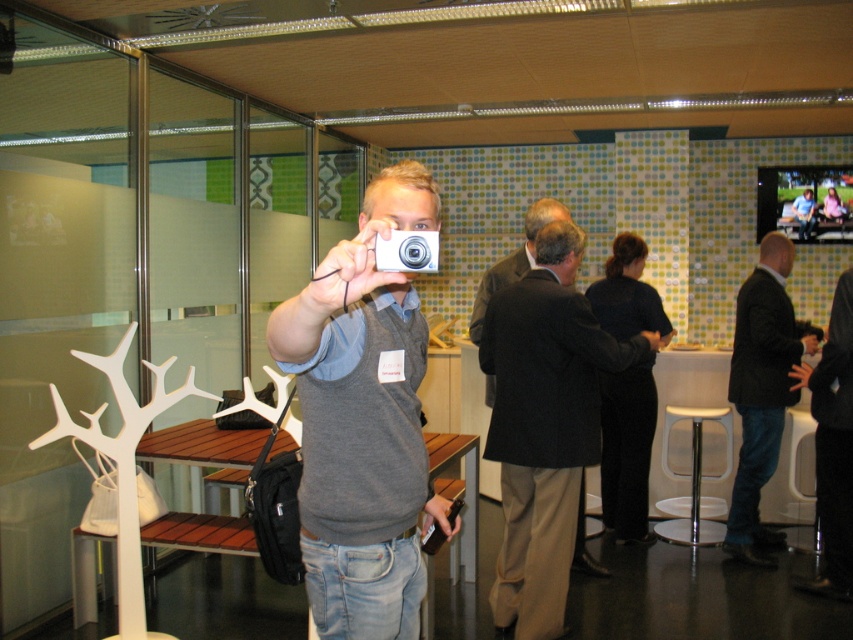
What are the coordinates of the matte silver camera at center?

The matte silver camera at center is located at coordinates point (363, 420).

You are setting up a photo shoot in this office space and need to place the matte silver camera at center and the white plastic stool at lower right. Since the camera is taller than the stool, where should you position the stool so it doesn

The white plastic stool at lower right should be placed below the matte silver camera at center to maintain visual balance, as the camera is taller than the stool.

You are an event planner organizing a photoshoot in this office space. You need to position a model wearing a dark brown suit at center at a specific coordinate. Where exactly should the model stand to match the scene?

The model wearing the dark brown suit at center should stand at point (544, 424) to match the scene.